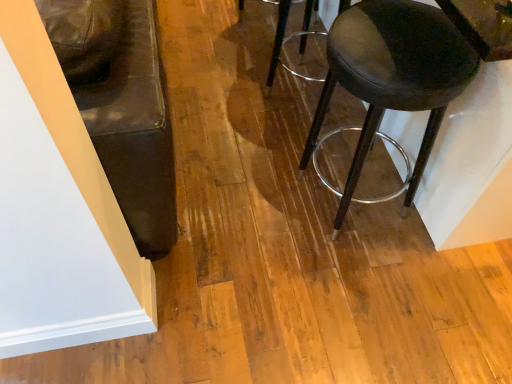
Question: Visually, is transparent plastic stool at center, which is the 1th stool in top-to-bottom order, positioned to the left or to the right of matte black stool at right, which ranks as the 2th stool in top-to-bottom order?

Choices:
 (A) right
 (B) left

Answer: (B)

Question: Is transparent plastic stool at center, which ranks as the 2th stool in bottom-to-top order, inside or outside of matte black stool at right, which ranks as the 2th stool in top-to-bottom order?

Choices:
 (A) outside
 (B) inside

Answer: (A)

Question: From a real-world perspective, is transparent plastic stool at center, which ranks as the 2th stool in bottom-to-top order, above or below matte black stool at right, the 1th stool positioned from the bottom?

Choices:
 (A) below
 (B) above

Answer: (A)

Question: Based on their positions, is matte black stool at right, the 1th stool positioned from the bottom, located to the left or right of transparent plastic stool at center, which ranks as the 2th stool in bottom-to-top order?

Choices:
 (A) right
 (B) left

Answer: (A)

Question: From the image's perspective, is matte black stool at right, the 1th stool positioned from the bottom, above or below transparent plastic stool at center, which is the 1th stool in top-to-bottom order?

Choices:
 (A) below
 (B) above

Answer: (A)

Question: Is matte black stool at right, which ranks as the 2th stool in top-to-bottom order, wider or thinner than transparent plastic stool at center, which ranks as the 2th stool in bottom-to-top order?

Choices:
 (A) wide
 (B) thin

Answer: (A)

Question: Is point (372, 56) closer or farther from the camera than point (284, 33)?

Choices:
 (A) closer
 (B) farther

Answer: (A)